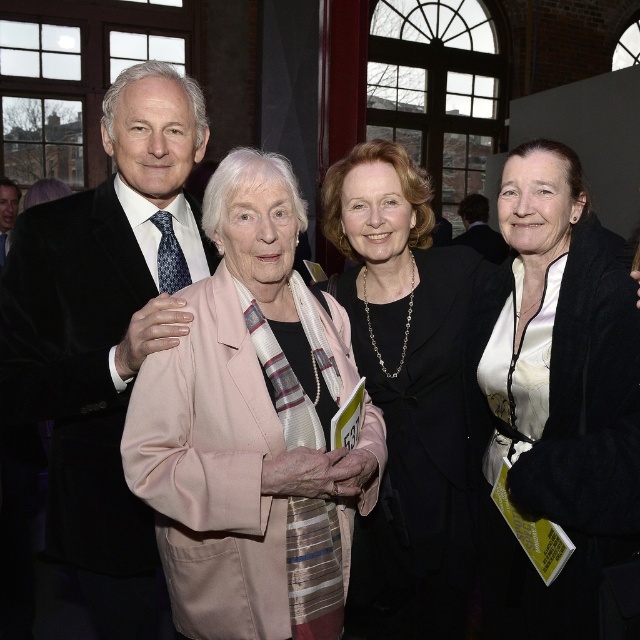
Between white silk blouse at center and black satin blazer at center, which one appears on the right side from the viewer's perspective?

Positioned to the right is white silk blouse at center.

Can you confirm if white silk blouse at center is thinner than black satin blazer at center?

Yes, white silk blouse at center is thinner than black satin blazer at center.

Who is more forward, (474, 400) or (417, 416)?

Point (417, 416)

The image size is (640, 640). Find the location of `white silk blouse at center`. white silk blouse at center is located at coordinates (554, 397).

Is the position of pink satin blazer at center more distant than that of matte black suit at left?

No, pink satin blazer at center is in front of matte black suit at left.

Identify the location of pink satin blazer at center. (252, 426).

Does velvet black suit at upper left have a greater width compared to matte black suit at left?

Yes, velvet black suit at upper left is wider than matte black suit at left.

Can you confirm if velvet black suit at upper left is positioned to the right of matte black suit at left?

Correct, you'll find velvet black suit at upper left to the right of matte black suit at left.

At what (x,y) coordinates should I click in order to perform the action: click on velvet black suit at upper left. Please return your answer as a coordinate pair (x, y). The width and height of the screenshot is (640, 640). Looking at the image, I should click on (106, 330).